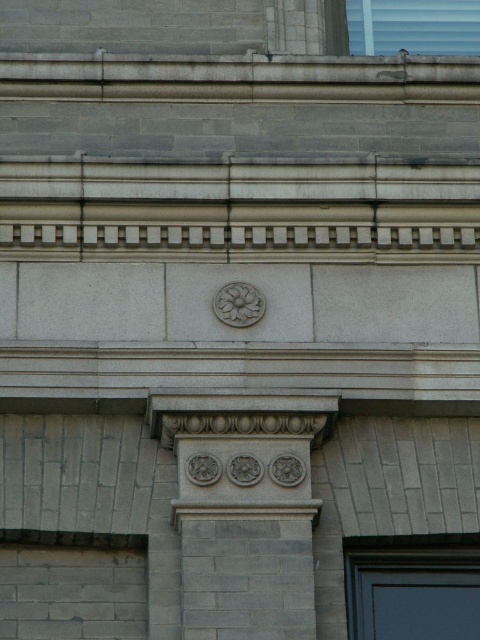
Question: Which object appears closest to the camera in this image?

Choices:
 (A) gray stone column at center
 (B) carved stone flower at center

Answer: (A)

Question: Can you confirm if gray stone column at center is positioned below carved stone flower at center?

Choices:
 (A) yes
 (B) no

Answer: (A)

Question: Can you confirm if gray stone column at center is wider than carved stone flower at center?

Choices:
 (A) yes
 (B) no

Answer: (A)

Question: Which object is closer to the camera taking this photo?

Choices:
 (A) carved stone flower at center
 (B) gray stone column at center

Answer: (B)

Question: Which point is closer to the camera taking this photo?

Choices:
 (A) (227, 556)
 (B) (225, 321)

Answer: (A)

Question: Can you confirm if gray stone column at center is smaller than carved stone flower at center?

Choices:
 (A) no
 (B) yes

Answer: (B)